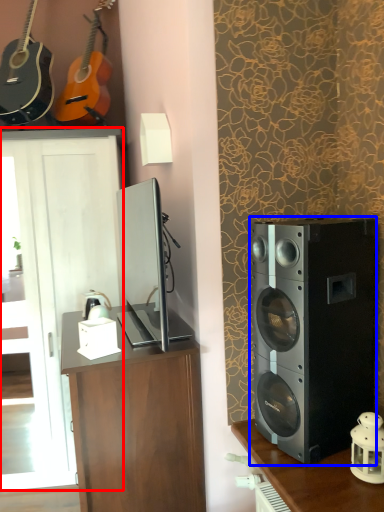
Question: Which of the following is the closest to the observer, cabinetry (highlighted by a red box) or loudspeaker (highlighted by a blue box)?

Choices:
 (A) cabinetry
 (B) loudspeaker

Answer: (B)